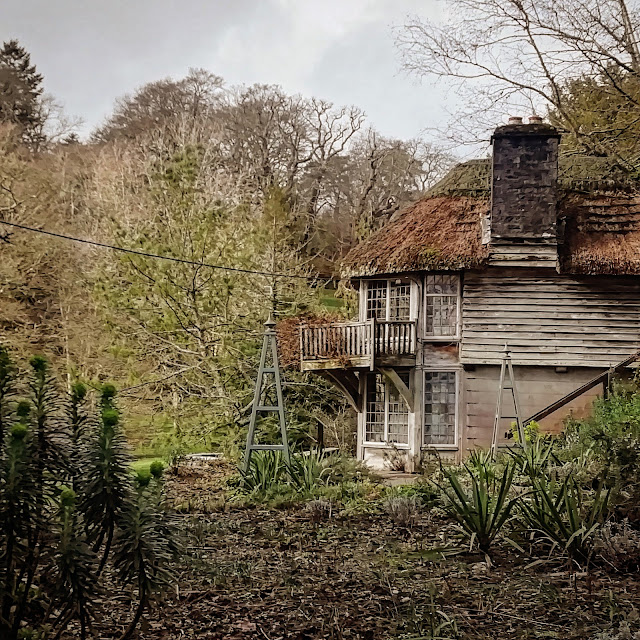
Where is `window`? window is located at coordinates (372, 299), (399, 308), (441, 310), (443, 400), (402, 409), (374, 413).